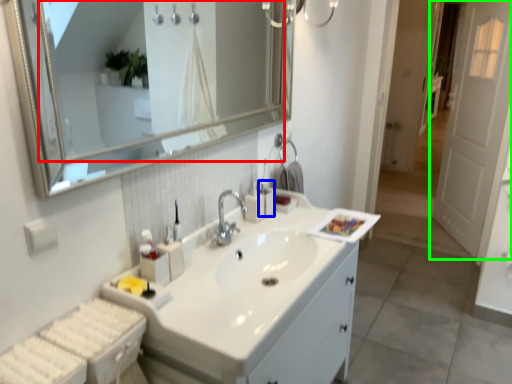
Question: Based on their relative distances, which object is farther from mirror (highlighted by a red box)? Choose from toiletry (highlighted by a blue box) and door (highlighted by a green box).

Choices:
 (A) toiletry
 (B) door

Answer: (B)